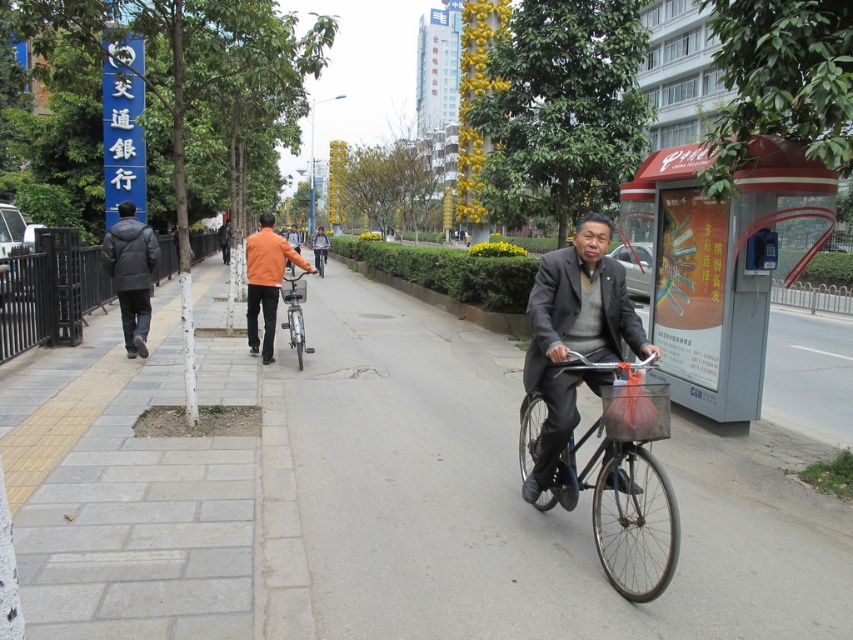
How much distance is there between gray concrete pavement at center and metallic silver bicycle at center?

They are 20.74 meters apart.

Does gray concrete pavement at center appear on the right side of metallic silver bicycle at center?

Yes, gray concrete pavement at center is to the right of metallic silver bicycle at center.

You are a GUI agent. You are given a task and a screenshot of the screen. Output one action in this format:
    pyautogui.click(x=<x>, y=<y>)
    Task: Click on the gray concrete pavement at center
    Image resolution: width=853 pixels, height=640 pixels.
    Given the screenshot: What is the action you would take?
    pyautogui.click(x=374, y=499)

Is silver metallic bicycle at center below metallic silver bicycle at center?

Yes, silver metallic bicycle at center is below metallic silver bicycle at center.

Describe the element at coordinates (294, 310) in the screenshot. Image resolution: width=853 pixels, height=640 pixels. I see `silver metallic bicycle at center` at that location.

Locate an element on the screen. The height and width of the screenshot is (640, 853). silver metallic bicycle at center is located at coordinates (294, 310).

Does shiny black bicycle at center lie behind orange matte jacket at center?

No, shiny black bicycle at center is in front of orange matte jacket at center.

Which is behind, point (671, 493) or point (305, 262)?

Positioned behind is point (305, 262).

You are a GUI agent. You are given a task and a screenshot of the screen. Output one action in this format:
    pyautogui.click(x=<x>, y=<y>)
    Task: Click on the shiny black bicycle at center
    Image resolution: width=853 pixels, height=640 pixels.
    Given the screenshot: What is the action you would take?
    619,465

I want to click on shiny black bicycle at center, so click(x=619, y=465).